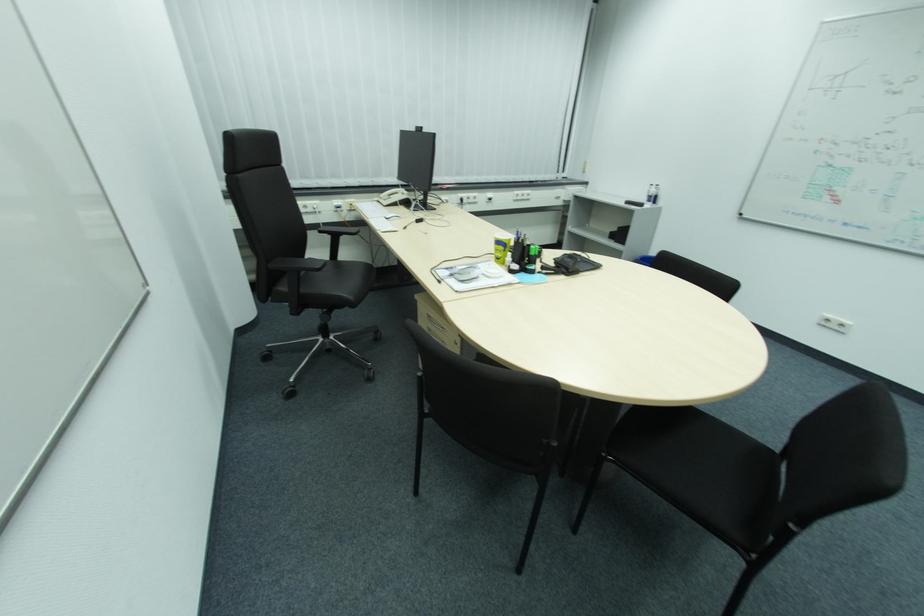
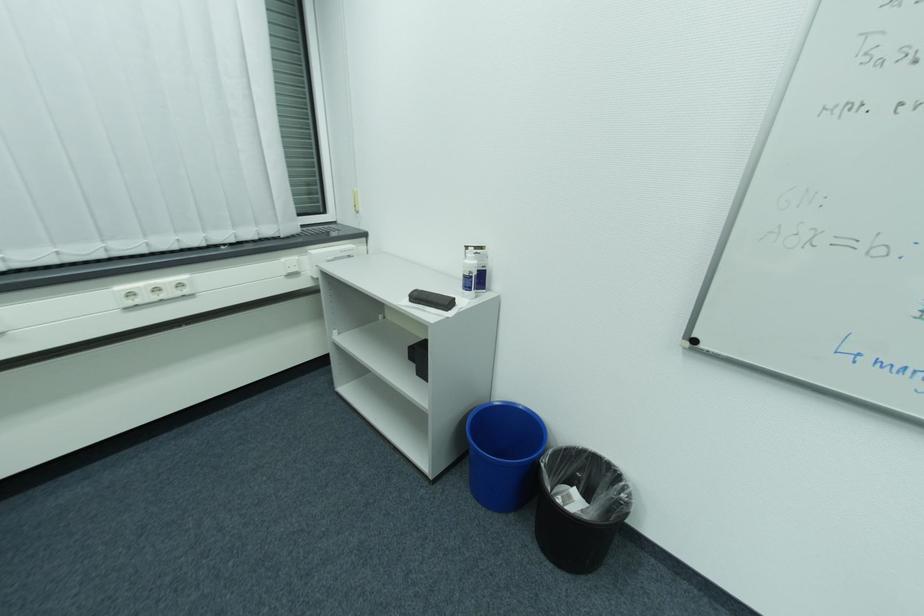
Where in the second image is the point corresponding to pixel 660 191 from the first image?

(478, 264)